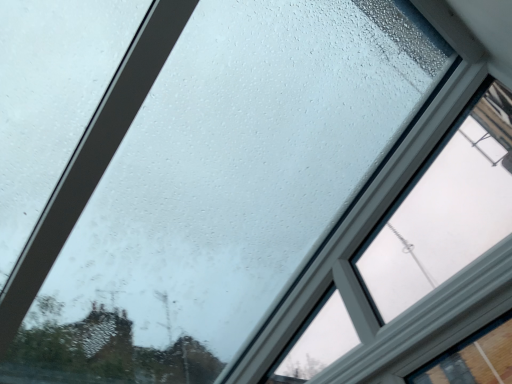
This screenshot has height=384, width=512. Describe the element at coordinates (412, 261) in the screenshot. I see `transparent glass window at center` at that location.

Locate an element on the screen. The height and width of the screenshot is (384, 512). transparent glass window at center is located at coordinates (412, 261).

Identify the location of transparent glass window at center. (412, 261).